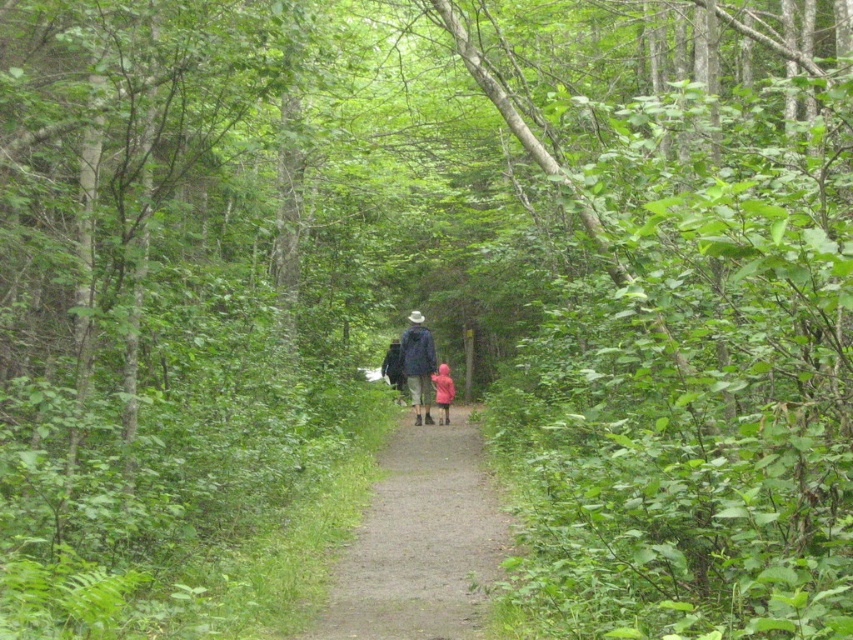
Between dirt path at center and pink matte jacket at center, which one is positioned lower?

dirt path at center is below.

Is dirt path at center further to the viewer compared to pink matte jacket at center?

No.

What do you see at coordinates (421, 541) in the screenshot? I see `dirt path at center` at bounding box center [421, 541].

The width and height of the screenshot is (853, 640). What are the coordinates of `dirt path at center` in the screenshot? It's located at (421, 541).

Is dirt path at center behind dark blue jacket at center?

No, dirt path at center is closer to the viewer.

Is dirt path at center bigger than dark blue jacket at center?

Indeed, dirt path at center has a larger size compared to dark blue jacket at center.

Is point (341, 561) positioned after point (422, 406)?

No, (341, 561) is closer to viewer.

Identify the location of dirt path at center. Image resolution: width=853 pixels, height=640 pixels. (421, 541).

Find the location of `dark blue jacket at center`. dark blue jacket at center is located at coordinates (416, 365).

Is point (425, 419) farther from viewer compared to point (436, 385)?

No.

At what (x,y) coordinates should I click in order to perform the action: click on dark blue jacket at center. Please return your answer as a coordinate pair (x, y). The height and width of the screenshot is (640, 853). Looking at the image, I should click on (416, 365).